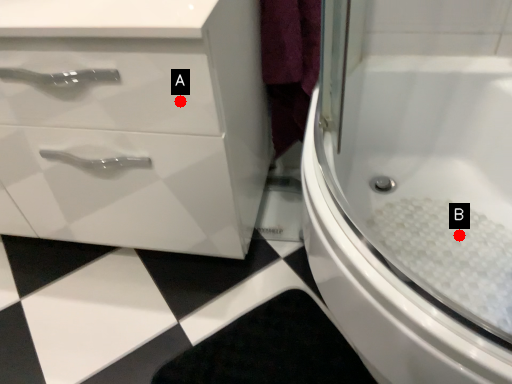
Question: Two points are circled on the image, labeled by A and B beside each circle. Which point appears closest to the camera in this image?

Choices:
 (A) A is closer
 (B) B is closer

Answer: (A)